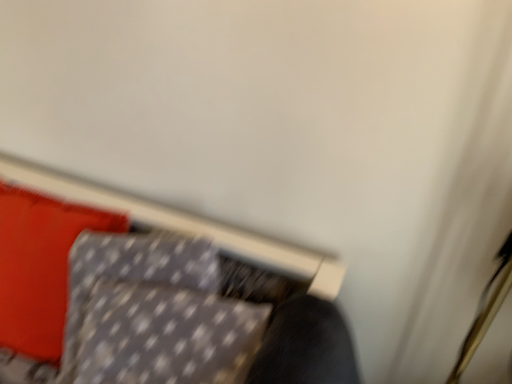
Describe the element at coordinates (150, 294) in the screenshot. I see `gray dotted fabric cushion at lower left` at that location.

Locate an element on the screen. gray dotted fabric cushion at lower left is located at coordinates (150, 294).

Image resolution: width=512 pixels, height=384 pixels. What do you see at coordinates (40, 267) in the screenshot? I see `gray dotted pillow at upper left` at bounding box center [40, 267].

Measure the distance between point (15, 217) and camera.

They are 3.38 feet apart.

I want to click on gray dotted pillow at upper left, so click(x=40, y=267).

Locate an element on the screen. gray dotted fabric cushion at lower left is located at coordinates (150, 294).

Is gray dotted pillow at upper left at the right side of gray dotted fabric cushion at lower left?

No.

Who is more distant, gray dotted pillow at upper left or gray dotted fabric cushion at lower left?

Positioned behind is gray dotted pillow at upper left.

Is point (27, 314) farther from camera compared to point (245, 307)?

Yes, it is.

From the image's perspective, who appears lower, gray dotted pillow at upper left or gray dotted fabric cushion at lower left?

From the image's view, gray dotted fabric cushion at lower left is below.

From a real-world perspective, is gray dotted pillow at upper left over gray dotted fabric cushion at lower left?

No, from a real-world perspective, gray dotted pillow at upper left is not over gray dotted fabric cushion at lower left

Considering the sizes of gray dotted pillow at upper left and gray dotted fabric cushion at lower left in the image, is gray dotted pillow at upper left wider or thinner than gray dotted fabric cushion at lower left?

gray dotted pillow at upper left is thinner than gray dotted fabric cushion at lower left.

Considering the sizes of gray dotted pillow at upper left and gray dotted fabric cushion at lower left in the image, is gray dotted pillow at upper left taller or shorter than gray dotted fabric cushion at lower left?

Considering their sizes, gray dotted pillow at upper left has more height than gray dotted fabric cushion at lower left.

Does gray dotted pillow at upper left have a smaller size compared to gray dotted fabric cushion at lower left?

Yes, gray dotted pillow at upper left is smaller than gray dotted fabric cushion at lower left.

Would you say gray dotted pillow at upper left contains gray dotted fabric cushion at lower left?

Definitely not — gray dotted fabric cushion at lower left is not inside gray dotted pillow at upper left.

Is gray dotted pillow at upper left beside gray dotted fabric cushion at lower left?

Yes.

Is gray dotted pillow at upper left turned away from gray dotted fabric cushion at lower left?

That's not correct — gray dotted pillow at upper left is not looking away from gray dotted fabric cushion at lower left.

How many degrees apart are the facing directions of gray dotted pillow at upper left and gray dotted fabric cushion at lower left?

The angular difference between gray dotted pillow at upper left and gray dotted fabric cushion at lower left is 21.9 degrees.

Identify the location of furniture in front of the gray dotted pillow at upper left. (150, 294).

Considering the positions of objects gray dotted fabric cushion at lower left and gray dotted pillow at upper left in the image provided, who is more to the left, gray dotted fabric cushion at lower left or gray dotted pillow at upper left?

gray dotted pillow at upper left.

Is gray dotted fabric cushion at lower left behind gray dotted pillow at upper left?

No, gray dotted fabric cushion at lower left is in front of gray dotted pillow at upper left.

Which is less distant, (283, 383) or (55, 200)?

Positioned in front is point (283, 383).

From the image's perspective, between gray dotted fabric cushion at lower left and gray dotted pillow at upper left, which one is located above?

gray dotted pillow at upper left appears higher in the image.

From a real-world perspective, is gray dotted fabric cushion at lower left on top of gray dotted pillow at upper left?

Yes.

Is gray dotted fabric cushion at lower left wider than gray dotted pillow at upper left?

Correct, the width of gray dotted fabric cushion at lower left exceeds that of gray dotted pillow at upper left.

Is gray dotted fabric cushion at lower left shorter than gray dotted pillow at upper left?

Indeed, gray dotted fabric cushion at lower left has a lesser height compared to gray dotted pillow at upper left.

Considering the relative sizes of gray dotted fabric cushion at lower left and gray dotted pillow at upper left in the image provided, is gray dotted fabric cushion at lower left smaller than gray dotted pillow at upper left?

Actually, gray dotted fabric cushion at lower left might be larger than gray dotted pillow at upper left.

Can gray dotted pillow at upper left be found inside gray dotted fabric cushion at lower left?

No, gray dotted fabric cushion at lower left does not contain gray dotted pillow at upper left.

Is gray dotted fabric cushion at lower left not close to gray dotted pillow at upper left?

gray dotted fabric cushion at lower left is actually quite close to gray dotted pillow at upper left.

Could you tell me if gray dotted fabric cushion at lower left is turned towards gray dotted pillow at upper left?

No, gray dotted fabric cushion at lower left is not facing towards gray dotted pillow at upper left.

Measure the distance from gray dotted fabric cushion at lower left to gray dotted pillow at upper left.

A distance of 3.92 inches exists between gray dotted fabric cushion at lower left and gray dotted pillow at upper left.

This screenshot has width=512, height=384. What are the coordinates of `furniture on the right of gray dotted pillow at upper left` in the screenshot? It's located at (150, 294).

At what (x,y) coordinates should I click in order to perform the action: click on pillow above the gray dotted fabric cushion at lower left (from the image's perspective). Please return your answer as a coordinate pair (x, y). Image resolution: width=512 pixels, height=384 pixels. Looking at the image, I should click on (40, 267).

Where is `furniture that is above the gray dotted pillow at upper left (from a real-world perspective)`? furniture that is above the gray dotted pillow at upper left (from a real-world perspective) is located at coordinates (150, 294).